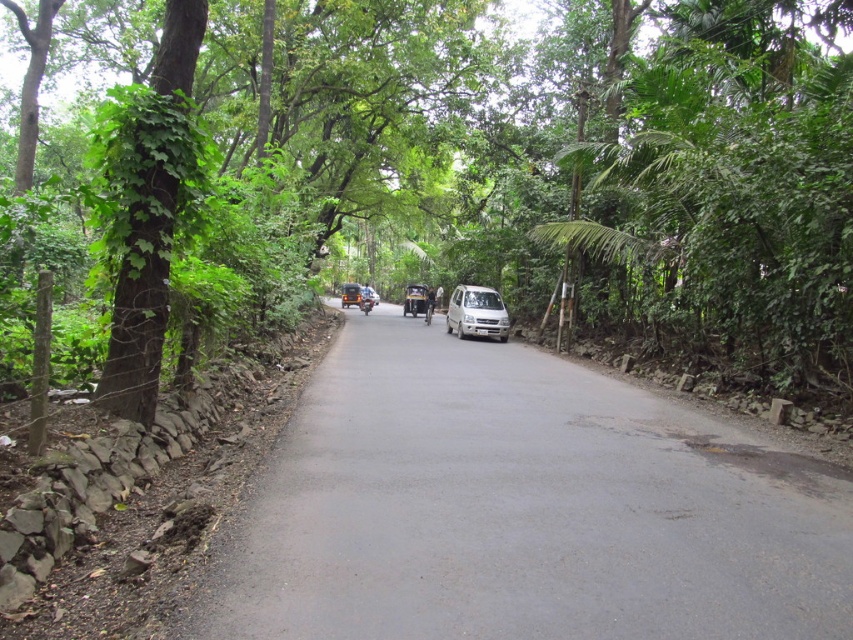
Question: Can you confirm if green leafy tree at center is wider than matte black car at center?

Choices:
 (A) yes
 (B) no

Answer: (A)

Question: Is green leafy tree at right to the right of white matte van at center from the viewer's perspective?

Choices:
 (A) no
 (B) yes

Answer: (B)

Question: Which of the following is the closest to the observer?

Choices:
 (A) smooth asphalt road at center
 (B) green leafy tree at right

Answer: (A)

Question: Estimate the real-world distances between objects in this image. Which object is closer to the green leafy tree at center?

Choices:
 (A) smooth asphalt road at center
 (B) green leafy tree at right
 (C) blue metallic motorcycle at center
 (D) green leafy tree at left

Answer: (B)

Question: Among these points, which one is farthest from the camera?

Choices:
 (A) (360, 292)
 (B) (375, 604)
 (C) (842, 225)

Answer: (A)

Question: Is green leafy tree at center behind blue metallic motorcycle at center?

Choices:
 (A) no
 (B) yes

Answer: (A)